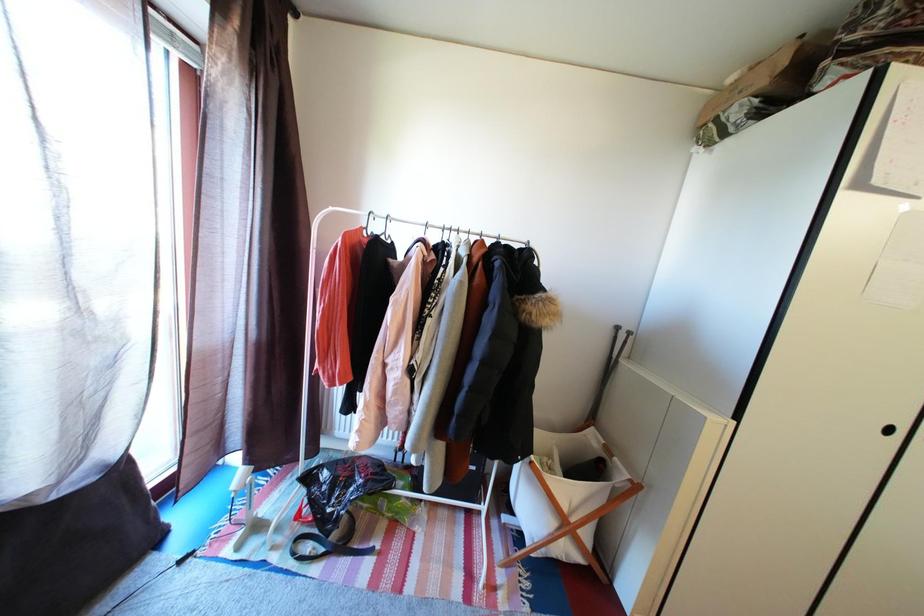
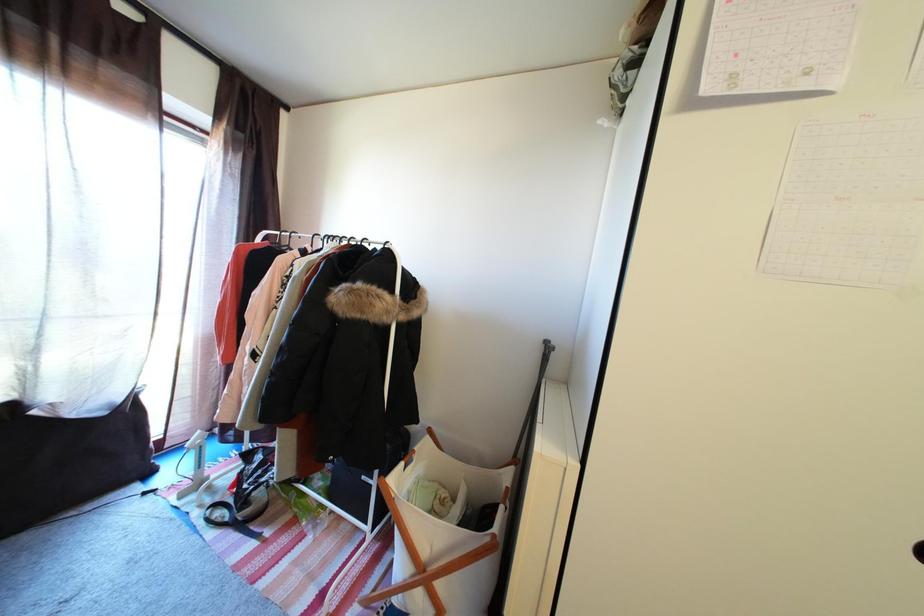
Question: What movement of the cameraman would produce the second image?

Choices:
 (A) Left
 (B) Right
 (C) Forward
 (D) Backward

Answer: (B)